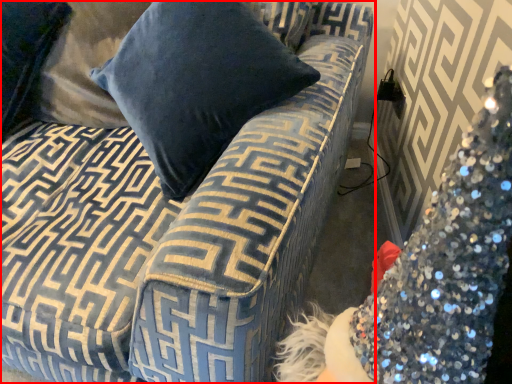
Question: From the image, what is the correct spatial relationship of studio couch (annotated by the red box) in relation to pillow?

Choices:
 (A) left
 (B) right

Answer: (B)